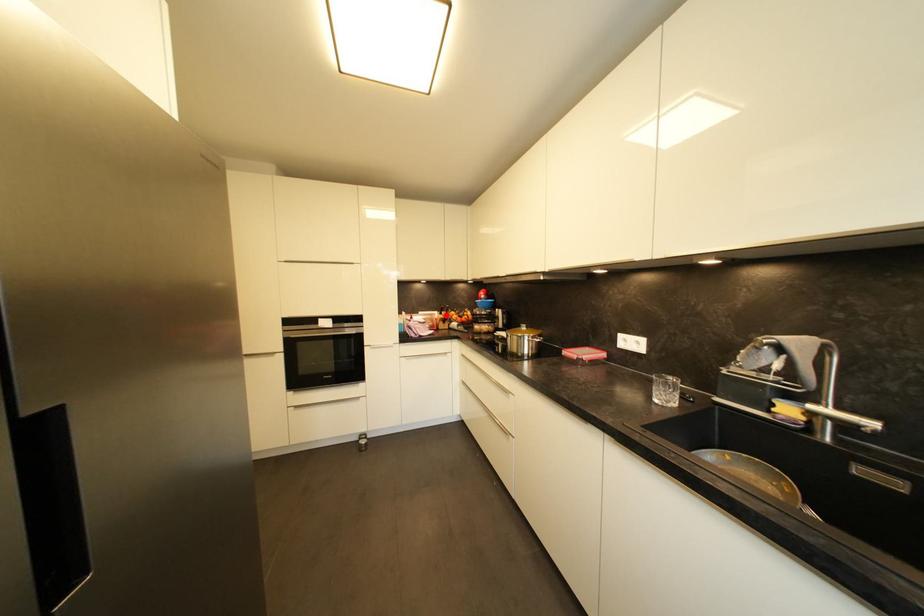
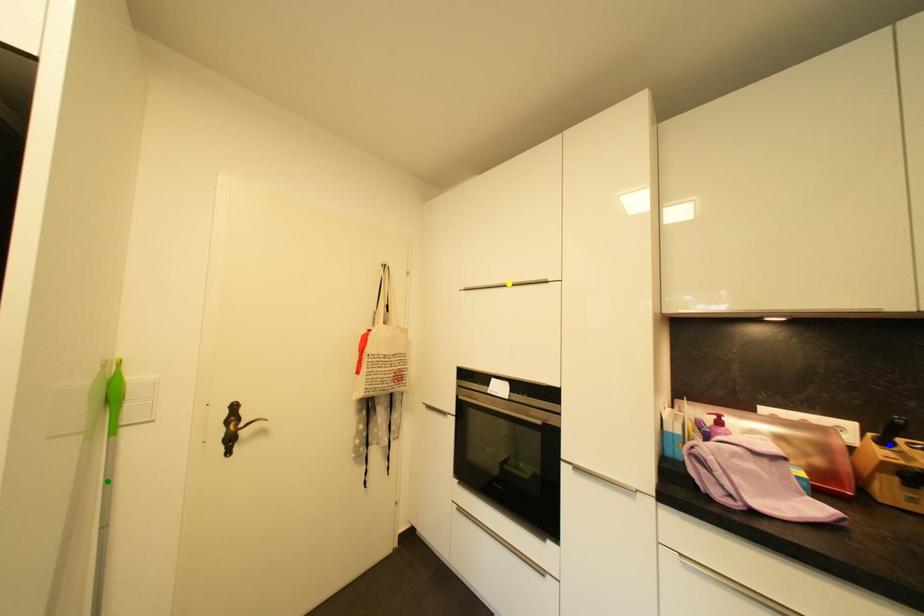
Question: I am providing you with two images of the same scene from different viewpoints. A red point is marked on the first image. You are given multiple points on the second image. Which spot in image 2 lines up with the point in image 1?

Choices:
 (A) yellow point
 (B) green point
 (C) blue point

Answer: (C)